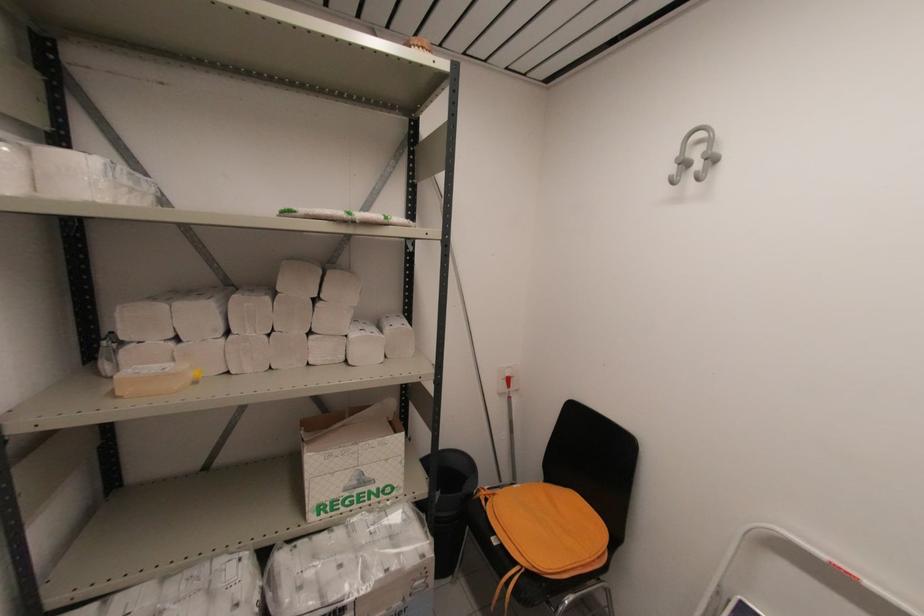
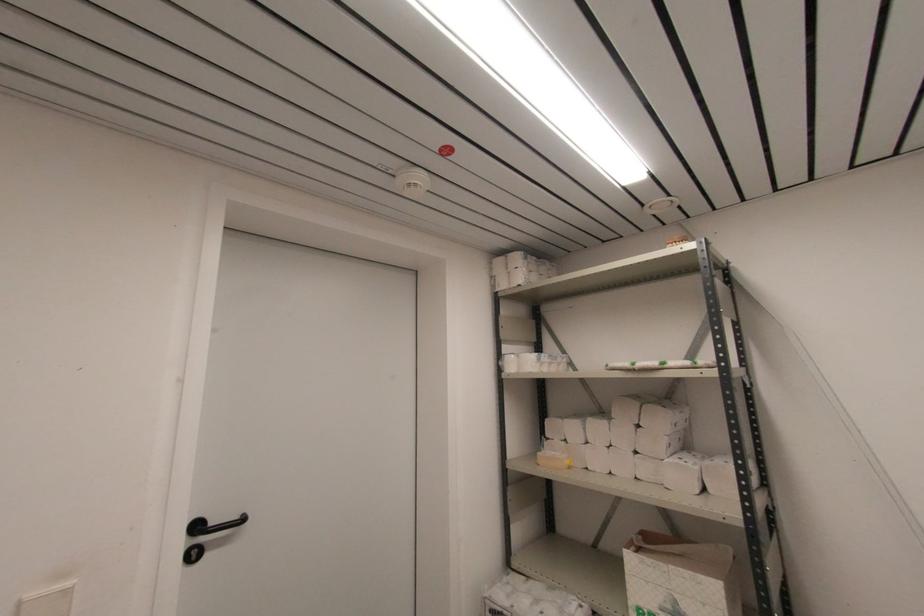
The point at (120, 398) is marked in the first image. Where is the corresponding point in the second image?

(540, 464)